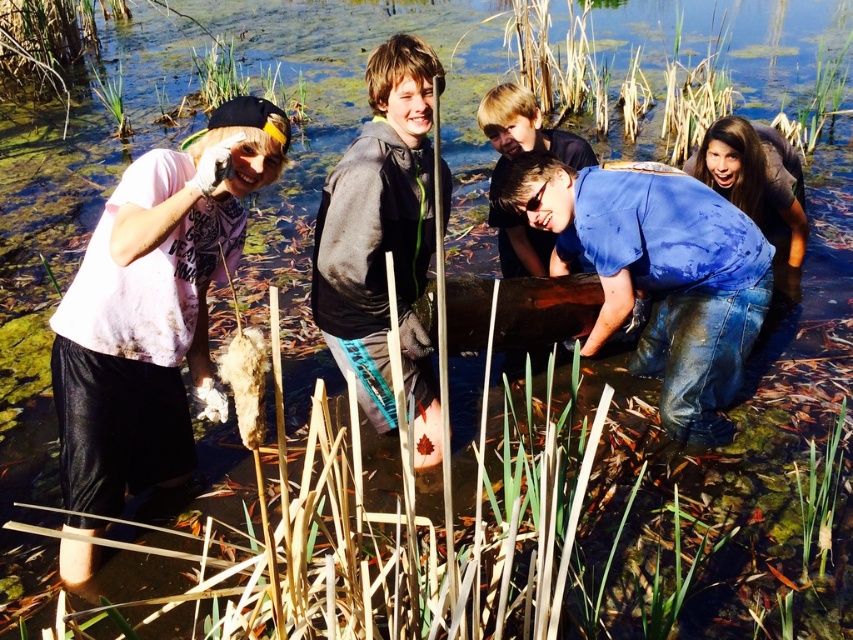
Which is behind, point (171, 372) or point (665, 392)?

Positioned behind is point (665, 392).

What do you see at coordinates (154, 307) in the screenshot?
I see `matte pink shirt at left` at bounding box center [154, 307].

Is point (195, 314) behind point (614, 328)?

No, it is in front of (614, 328).

Identify the location of matte pink shirt at left. (154, 307).

Is matte pink shirt at left to the right of dark gray fleece jacket at center from the viewer's perspective?

Incorrect, matte pink shirt at left is not on the right side of dark gray fleece jacket at center.

Based on the photo, is matte pink shirt at left positioned at the back of dark gray fleece jacket at center?

Yes.

Is point (183, 172) positioned in front of point (424, 252)?

Yes.

This screenshot has width=853, height=640. Find the location of `matte pink shirt at left`. matte pink shirt at left is located at coordinates (154, 307).

From the picture: Can you confirm if blue denim jeans at lower right is bigger than dark gray fleece jacket at center?

Incorrect, blue denim jeans at lower right is not larger than dark gray fleece jacket at center.

I want to click on blue denim jeans at lower right, so click(x=656, y=275).

Locate an element on the screen. blue denim jeans at lower right is located at coordinates (656, 275).